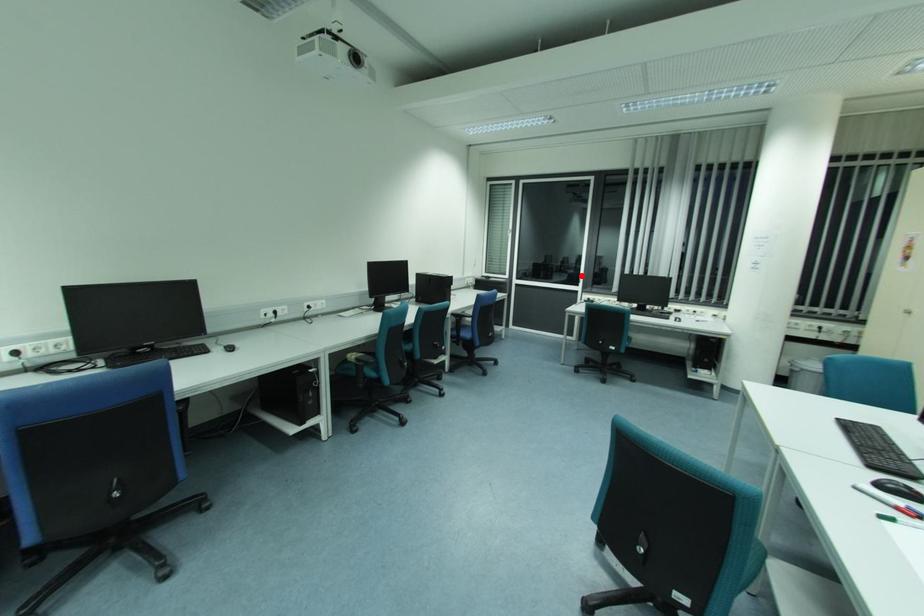
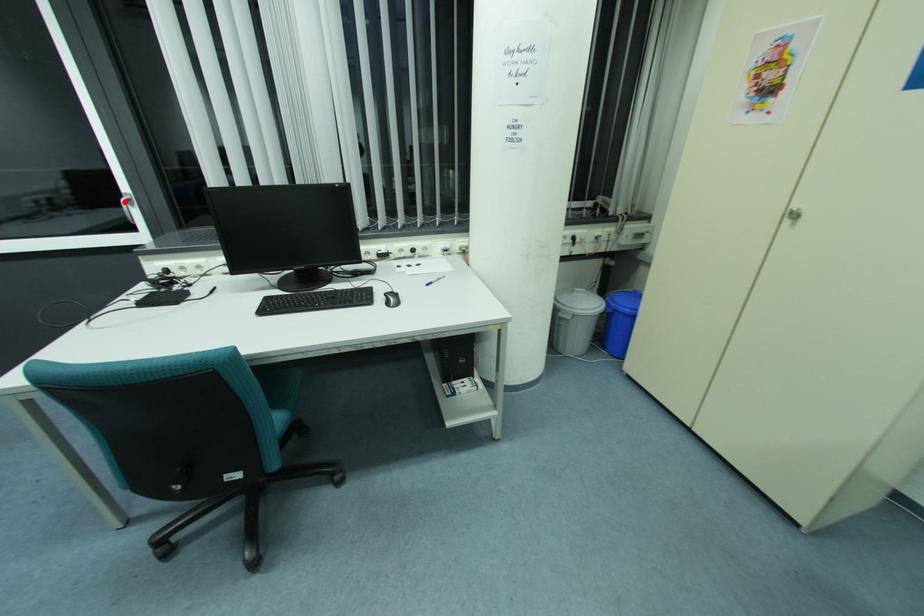
I am providing you with two images of the same scene from different viewpoints. A red point is marked on the first image and another point is marked on the second image. Is the marked point in image1 the same physical position as the marked point in image2?

Yes